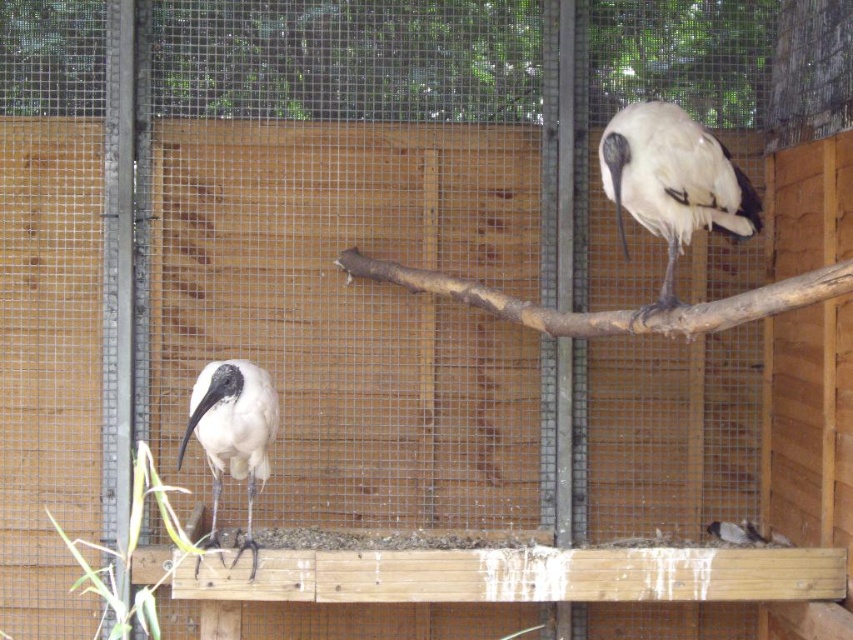
You are a zookeeper observing the enclosure. You notice two birds inside. Which of the two birds, the white matte bird at upper right or the white feathered bird at lower center, is taller?

The white matte bird at upper right is taller than the white feathered bird at lower center according to the description.

You are a zookeeper who needs to place a feeding tray between the white matte ibis at lower left and the white feathered bird at lower center. The tray must be placed exactly halfway between them. Given that the distance between the two birds is 2 meters, how wide should the feeding tray be to ensure it fits perfectly without overlapping either bird?

The feeding tray should be placed exactly halfway between the white matte ibis at lower left and the white feathered bird at lower center. Since the distance between them is 2 meters, the tray should be 1 meter wide to fit perfectly in the middle without overlapping either bird.